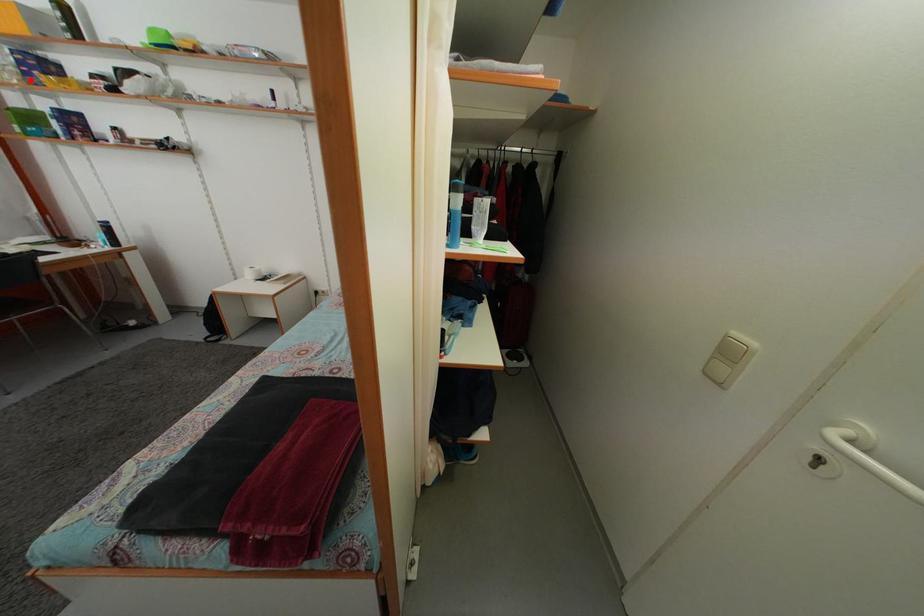
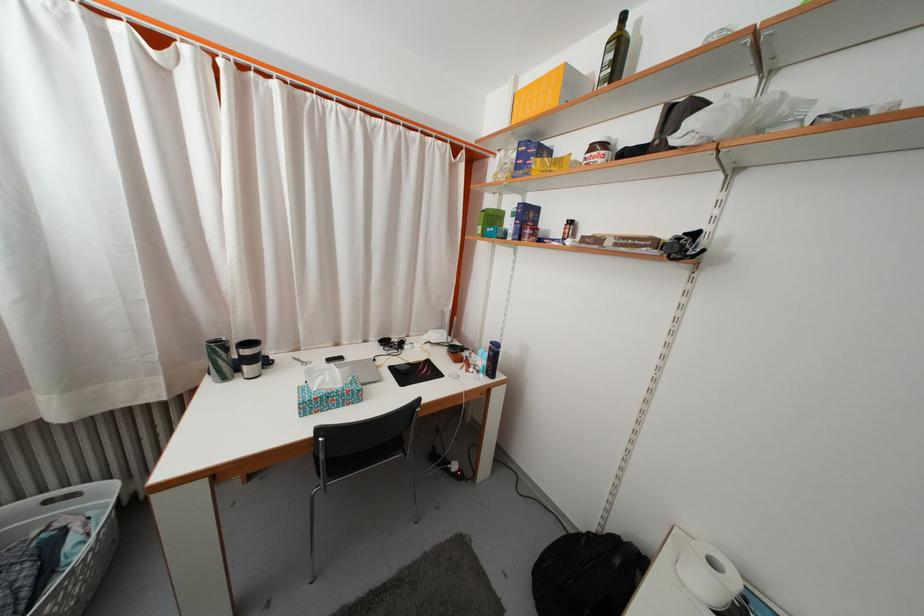
Question: I am providing you with two images of the same scene from different viewpoints. In image1, a red point is highlighted. Considering the same 3D point in image2, which of the following is correct?

Choices:
 (A) It is closer
 (B) It is farther

Answer: (A)